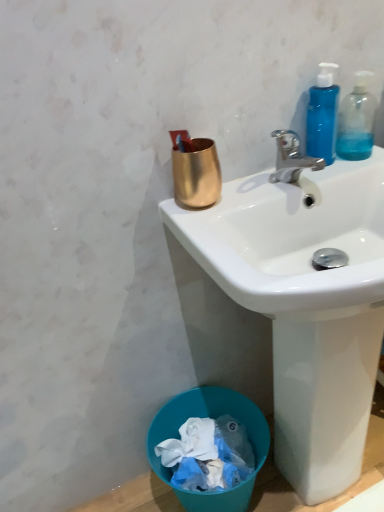
This screenshot has width=384, height=512. In order to click on free space to the left of polished chrome faucet at upper right in this screenshot , I will do `click(240, 194)`.